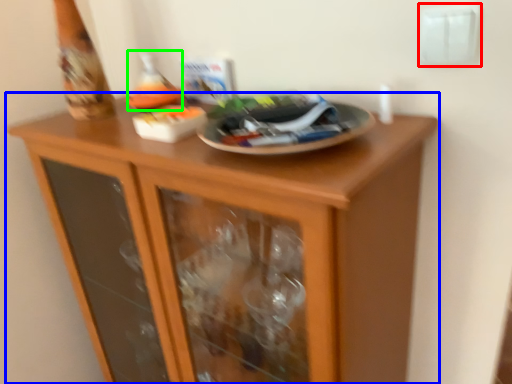
Question: Which object is positioned farthest from electric outlet (highlighted by a red box)? Select from cupboard (highlighted by a blue box) and wine bottle (highlighted by a green box).

Choices:
 (A) cupboard
 (B) wine bottle

Answer: (A)